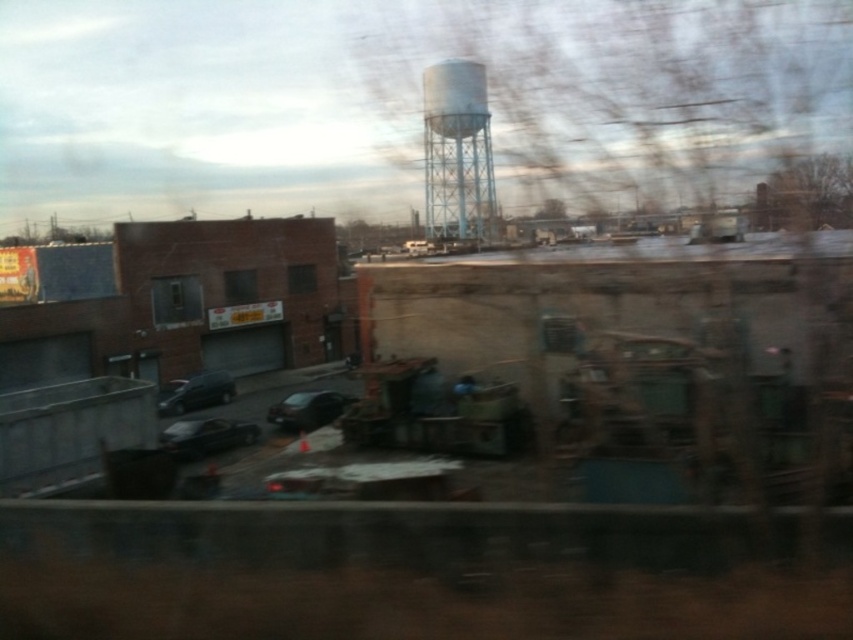
Is point (212, 422) more distant than point (230, 374)?

No.

Which of these two, shiny black sedan at center or shiny black car at lower left, stands taller?

shiny black car at lower left is taller.

Is point (242, 428) farther from camera compared to point (171, 390)?

No, it is in front of (171, 390).

Where is `shiny black sedan at center`? shiny black sedan at center is located at coordinates (206, 436).

What do you see at coordinates (457, 152) in the screenshot?
I see `white textured water tower at center` at bounding box center [457, 152].

Between white textured water tower at center and shiny black car at lower left, which one is positioned lower?

shiny black car at lower left is below.

What do you see at coordinates (457, 152) in the screenshot? The height and width of the screenshot is (640, 853). I see `white textured water tower at center` at bounding box center [457, 152].

Where is `white textured water tower at center`? white textured water tower at center is located at coordinates (457, 152).

Between point (469, 140) and point (152, 285), which one is positioned behind?

Point (152, 285)

The width and height of the screenshot is (853, 640). I want to click on white textured water tower at center, so click(457, 152).